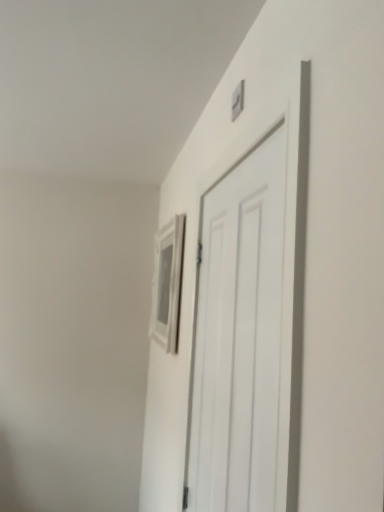
Question: Is matte silver picture frame at upper center taller or shorter than white matte door at center?

Choices:
 (A) short
 (B) tall

Answer: (A)

Question: Considering their positions, is matte silver picture frame at upper center located in front of or behind white matte door at center?

Choices:
 (A) front
 (B) behind

Answer: (B)

Question: Is matte silver picture frame at upper center wider or thinner than white matte door at center?

Choices:
 (A) thin
 (B) wide

Answer: (B)

Question: Based on their sizes in the image, would you say white matte door at center is bigger or smaller than matte silver picture frame at upper center?

Choices:
 (A) small
 (B) big

Answer: (B)

Question: From a real-world perspective, is white matte door at center above or below matte silver picture frame at upper center?

Choices:
 (A) below
 (B) above

Answer: (A)

Question: Is white matte door at center taller or shorter than matte silver picture frame at upper center?

Choices:
 (A) tall
 (B) short

Answer: (A)

Question: Would you say white matte door at center is inside or outside matte silver picture frame at upper center?

Choices:
 (A) outside
 (B) inside

Answer: (A)